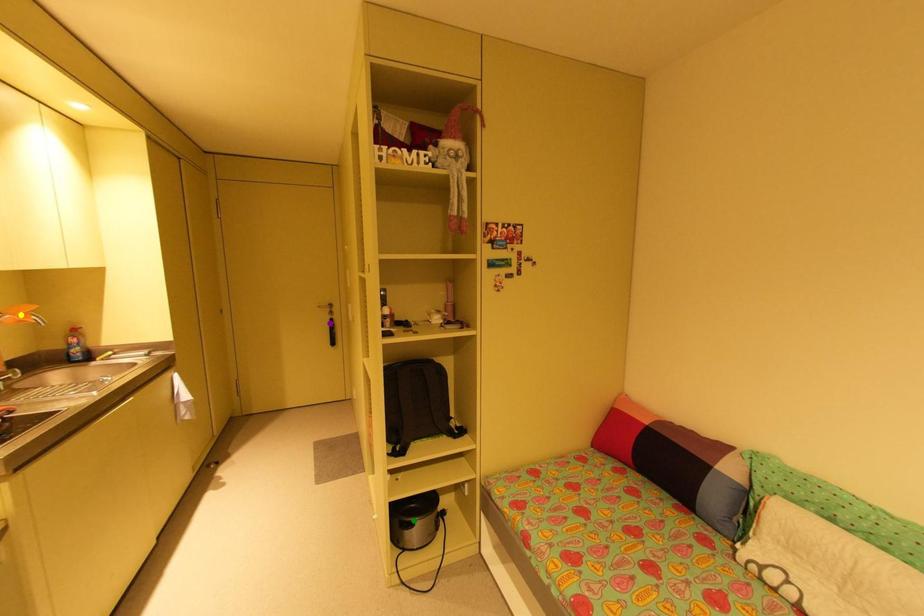
Consider the image. Order these from farthest to nearest:
purple point
green point
yellow point

1. purple point
2. green point
3. yellow point